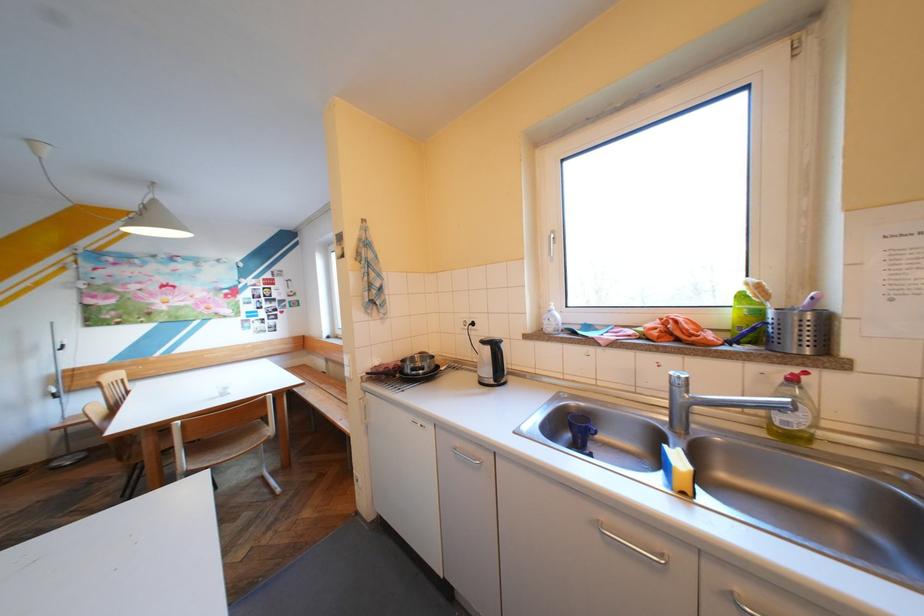
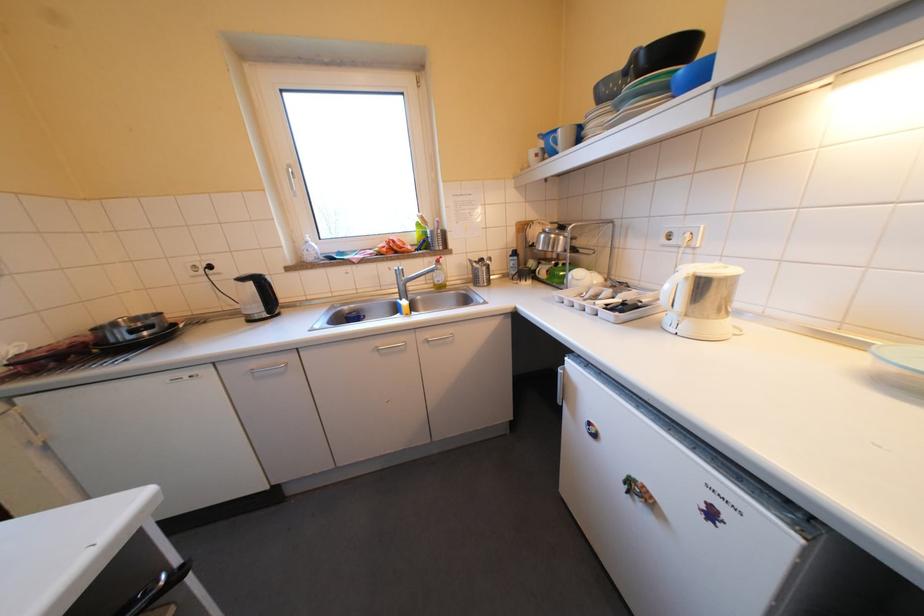
In the second image, find the point that corresponds to the point at 558,321 in the first image.

(319, 252)